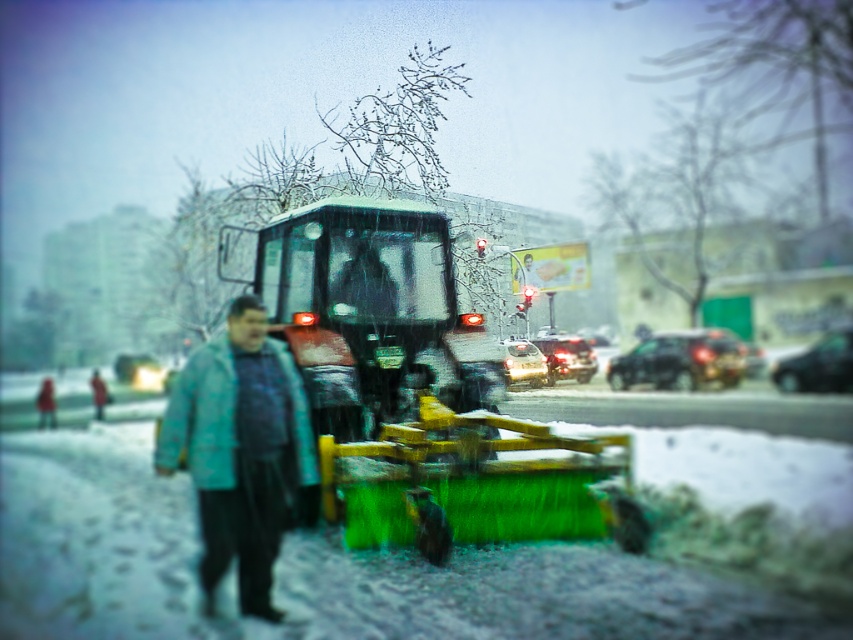
Does teal fabric jacket at center appear on the right side of matte blue jacket at center?

Correct, you'll find teal fabric jacket at center to the right of matte blue jacket at center.

Is point (233, 392) in front of point (91, 384)?

That is True.

Which is in front, point (294, 390) or point (96, 371)?

Positioned in front is point (294, 390).

At what (x,y) coordinates should I click in order to perform the action: click on teal fabric jacket at center. Please return your answer as a coordinate pair (x, y). This screenshot has height=640, width=853. Looking at the image, I should click on (241, 449).